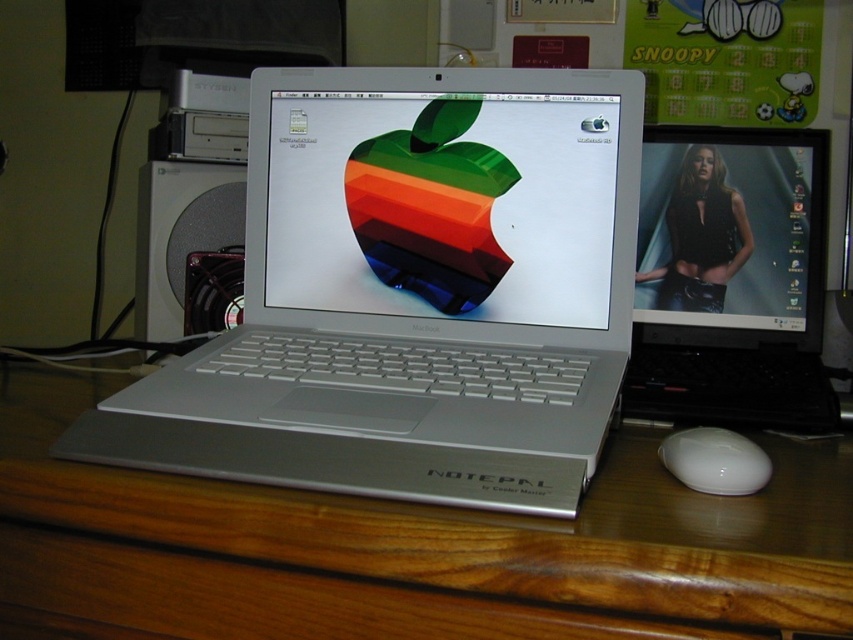
You are an office worker trying to locate two specific points in your workspace. The first point is at coordinates point (663, 241) and the second is at point (735, 444). According to the image, which point is closer to you?

Point (663, 241) is behind point (735, 444), so the point closer to you is point (735, 444).

Based on the photo, you are organizing your desk and want to place a new keyboard between the metallic apple at center and the white glossy mouse at lower right. Can you fit the keyboard there without moving either object?

The metallic apple at center is positioned over the white glossy mouse at lower right, meaning there is no space between them. Therefore, you cannot fit a keyboard between them without moving either object.

You are standing in front of the workspace shown in the image. You need to reach the matte black monitor at upper right to adjust its settings. Considering your arm length is 28 inches, can you comfortably reach it without moving your position?

The matte black monitor at upper right is 32.09 inches away from you, which is beyond your arm length of 28 inches. Therefore, you cannot comfortably reach it without moving your position.